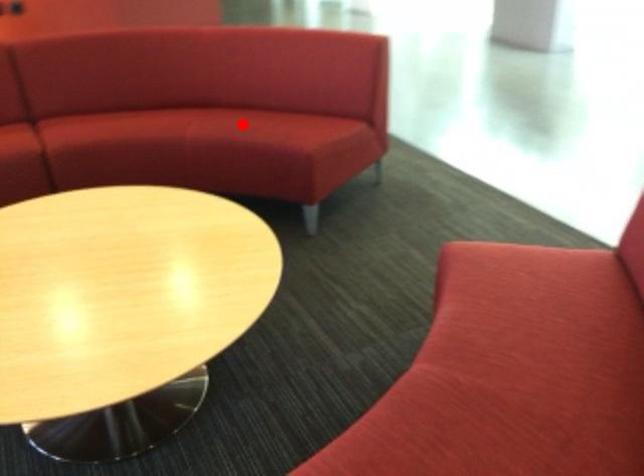
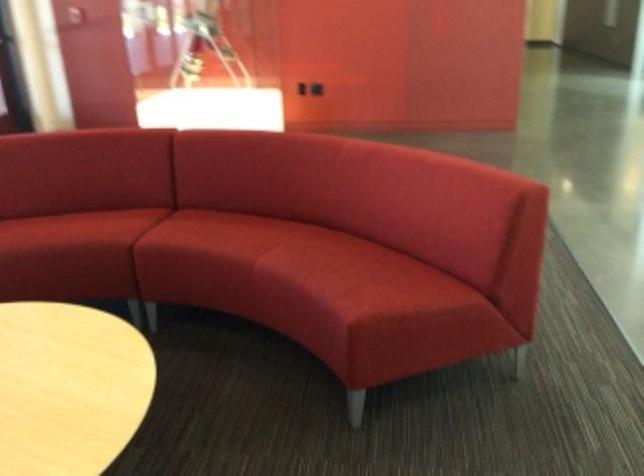
Question: I am providing you with two images of the same scene from different viewpoints. A red point is shown in image1. For the corresponding object point in image2, is it positioned nearer or farther from the camera?

Choices:
 (A) Nearer
 (B) Farther

Answer: (A)